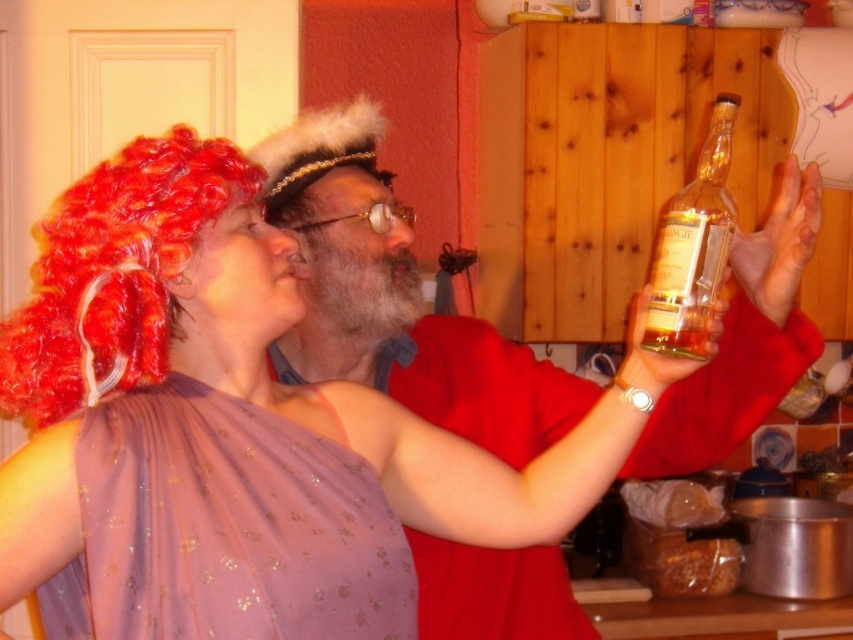
Question: Is matte glass bottle at upper right above purple satin dress at upper left?

Choices:
 (A) no
 (B) yes

Answer: (B)

Question: Based on their relative distances, which object is farther from the purple satin dress at upper left?

Choices:
 (A) matte glass bottle at upper right
 (B) clear glass bottle at upper right

Answer: (B)

Question: Does purple satin dress at upper left lie behind clear glass bottle at upper right?

Choices:
 (A) no
 (B) yes

Answer: (A)

Question: Which of the following is the farthest from the observer?

Choices:
 (A) (664, 266)
 (B) (242, 556)

Answer: (A)

Question: Where is matte glass bottle at upper right located in relation to purple satin dress at upper left in the image?

Choices:
 (A) below
 (B) above

Answer: (B)

Question: Which is farther from the clear glass bottle at upper right?

Choices:
 (A) purple satin dress at upper left
 (B) matte glass bottle at upper right

Answer: (A)